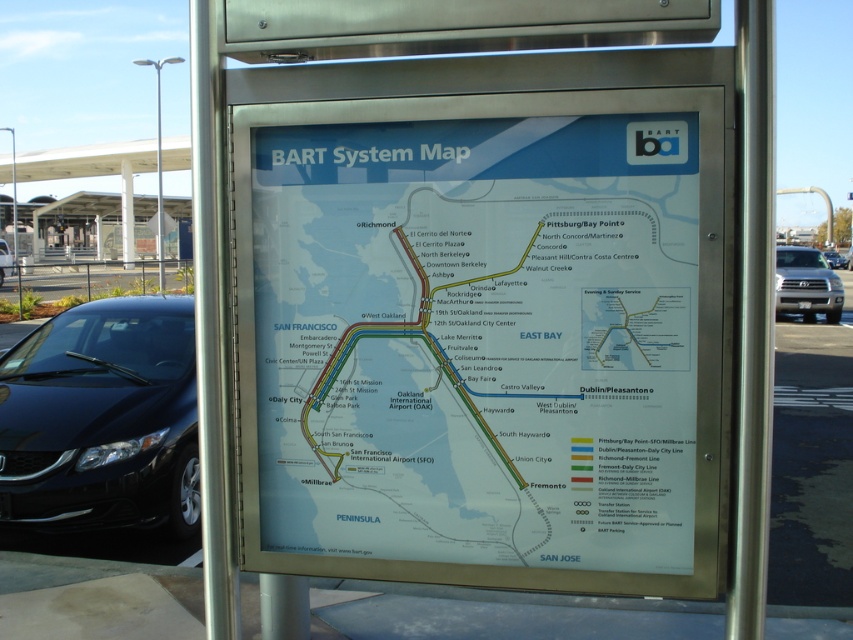
Looking at this image, can you confirm if silver metallic truck at right is positioned to the right of silver metallic suv at right?

Incorrect, silver metallic truck at right is not on the right side of silver metallic suv at right.

Can you confirm if silver metallic truck at right is taller than silver metallic suv at right?

Correct, silver metallic truck at right is much taller as silver metallic suv at right.

Is point (801, 296) more distant than point (828, 253)?

No, (801, 296) is in front of (828, 253).

Locate an element on the screen. This screenshot has height=640, width=853. silver metallic truck at right is located at coordinates (805, 284).

Can you confirm if shiny black sedan at left is bigger than silver metallic suv at right?

Indeed, shiny black sedan at left has a larger size compared to silver metallic suv at right.

Between shiny black sedan at left and silver metallic suv at right, which one appears on the left side from the viewer's perspective?

shiny black sedan at left

In order to click on shiny black sedan at left in this screenshot , I will do `click(6, 260)`.

Where is `shiny black sedan at left`? The image size is (853, 640). shiny black sedan at left is located at coordinates click(x=6, y=260).

Is point (169, 477) closer to viewer compared to point (0, 243)?

Yes, it is in front of point (0, 243).

Who is more forward, [54,502] or [3,260]?

Point [54,502]

This screenshot has height=640, width=853. I want to click on black glossy sedan at lower left, so click(102, 419).